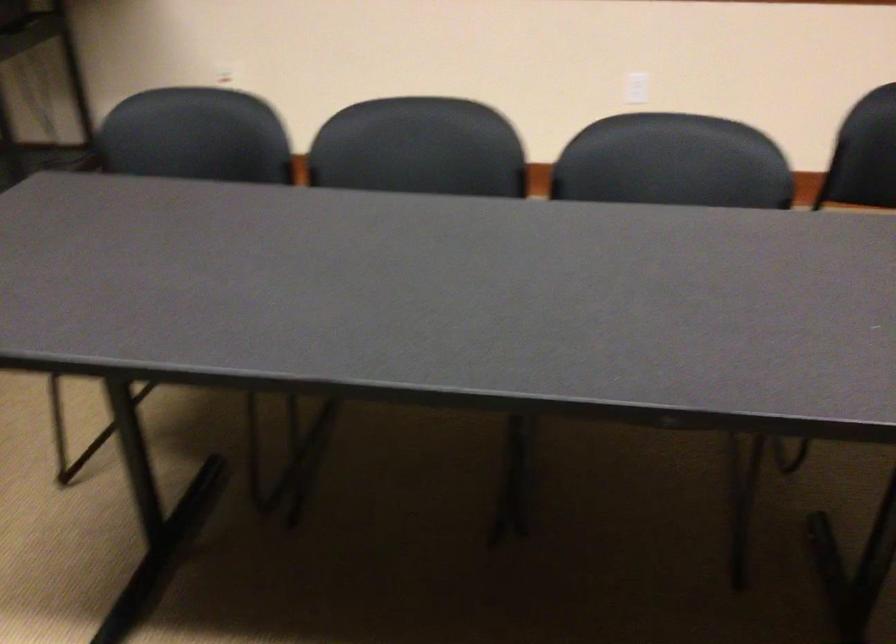
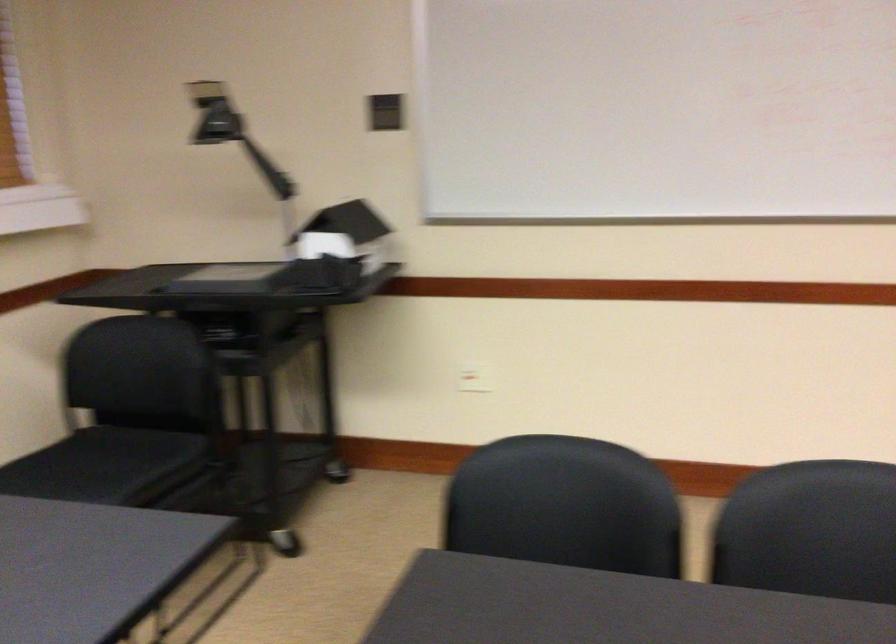
Find the pixel in the second image that matches pixel 214 84 in the first image.

(474, 377)